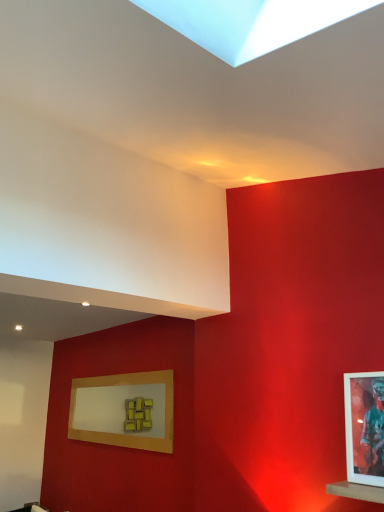
What do you see at coordinates (364, 426) in the screenshot? I see `white matte picture frame at upper right` at bounding box center [364, 426].

Where is `white matte picture frame at upper right`? The image size is (384, 512). white matte picture frame at upper right is located at coordinates (364, 426).

Image resolution: width=384 pixels, height=512 pixels. In order to click on white matte picture frame at upper right in this screenshot , I will do `click(364, 426)`.